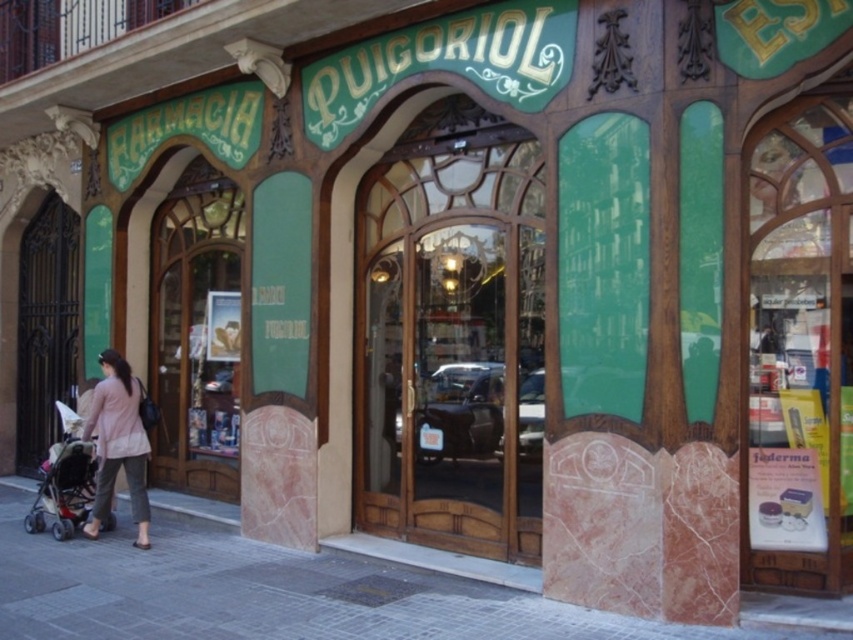
You are standing in front of the Farmacia Puigoriol storefront. The wooden glass door at center is where you need to enter. If you want to avoid the reflection of the parked cars seen through the door, should you stand to the left or right of the door?

The wooden glass door at center reflects the street and parked cars. To avoid the reflection, stand to the side opposite where the cars are parked. Since the door is at point (456, 336), but without knowing the exact direction of the cars, it is impossible to determine left or right. However, adjusting your position away from the reflection area should help.

You are a parent pushing a matte black stroller at lower left and want to cross the paved stone sidewalk at lower center to reach the pharmacy entrance. Is the width of the sidewalk sufficient for the stroller to pass through comfortably?

The paved stone sidewalk at lower center might be wider than matte black stroller at lower left, so it should be wide enough for the stroller to pass through comfortably.

You are a delivery person holding a package and need to place it on the paved stone sidewalk at lower center. However, there is a matte black stroller at lower left in the way. Based on their heights, can you easily place the package on the sidewalk without moving the stroller?

The paved stone sidewalk at lower center has a lesser height compared to the matte black stroller at lower left. Since the sidewalk is lower, you can easily place the package on it without needing to move the stroller.